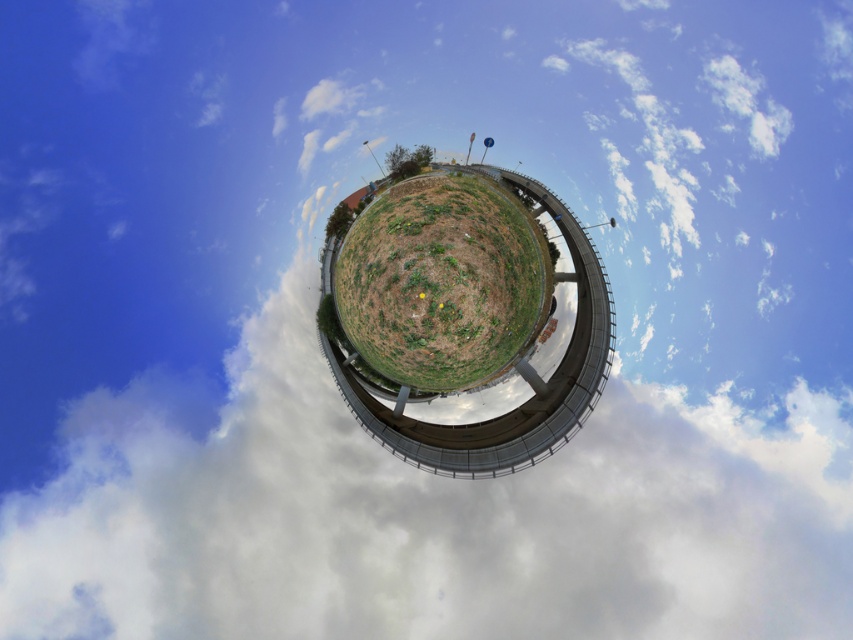
You are standing in the spherical panorama image of the landscape. You notice two points marked in the image. Which point, point (387, 166) or point (328, 236), is closer to your current position?

Point (387, 166) is further to the viewer than point (328, 236), so point (328, 236) is closer to your current position.

Based on the scene described, which of the two green leafy trees is wider? The green leafy tree at upper center or the green leafy tree at center?

The green leafy tree at upper center might be wider than the green leafy tree at center according to the description.